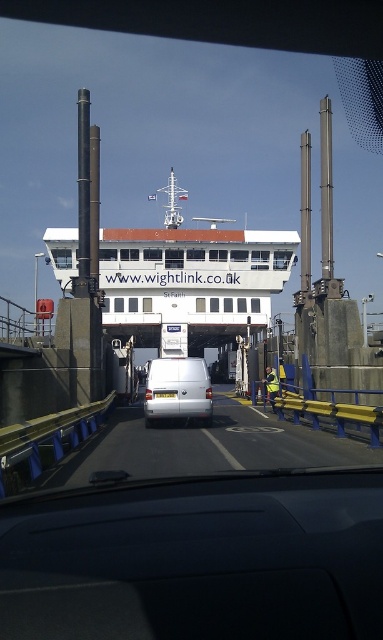
You are driving a car and want to board the ferry. You see the white matte ferry at center and the white matte van at center. Which one is bigger?

The white matte ferry at center is larger in size than the white matte van at center.

You are driving a car and want to board the ferry. You see the white matte ferry at center and the white matte van at center. Which one is higher up in the image?

The white matte ferry at center is located above the white matte van at center in the image.